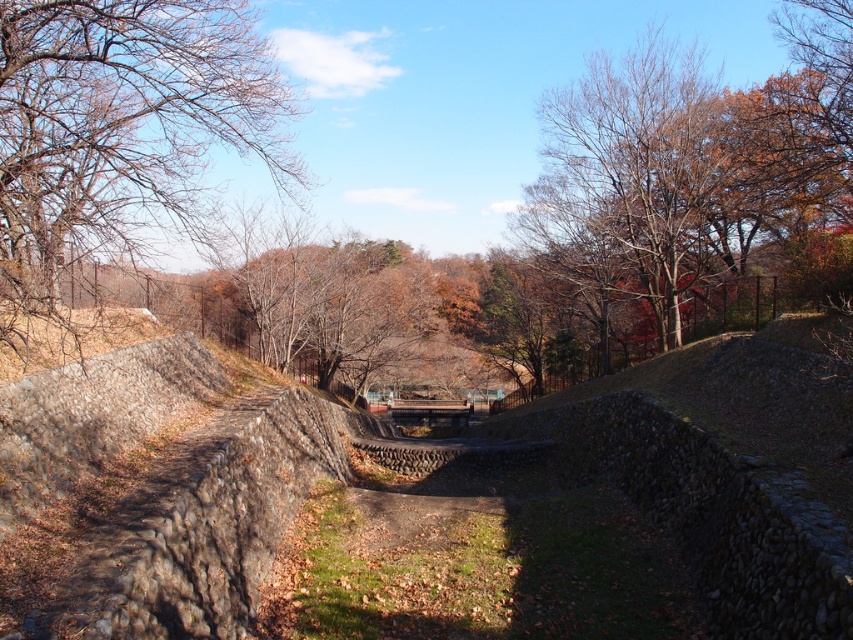
Does bare branches at upper left appear on the left side of rough stone mound at center?

Correct, you'll find bare branches at upper left to the left of rough stone mound at center.

Is bare branches at upper left to the right of rough stone mound at center from the viewer's perspective?

No, bare branches at upper left is not to the right of rough stone mound at center.

Which is behind, point (181, 177) or point (338, 454)?

Point (338, 454)

At what (x,y) coordinates should I click in order to perform the action: click on bare branches at upper left. Please return your answer as a coordinate pair (x, y). This screenshot has height=640, width=853. Looking at the image, I should click on (119, 129).